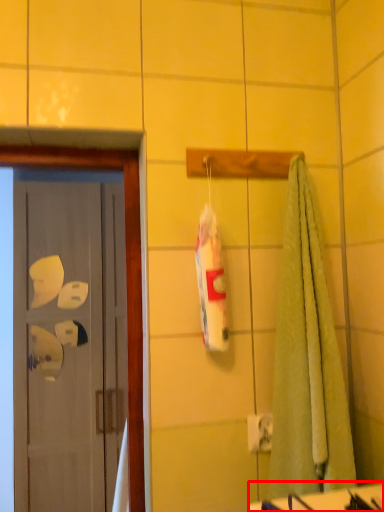
Question: From the image, what is the correct spatial relationship of counter top (annotated by the red box) in relation to door?

Choices:
 (A) left
 (B) right

Answer: (B)